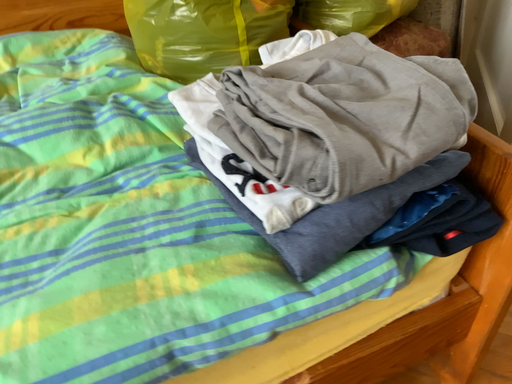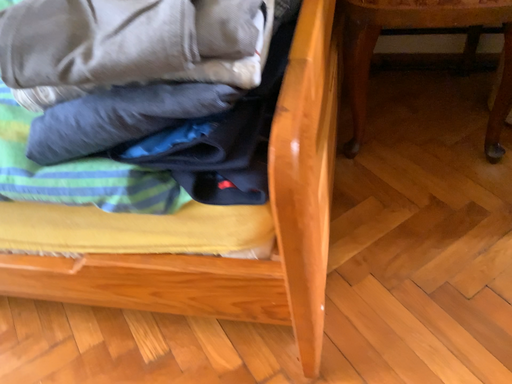
Question: Which way did the camera rotate in the video?

Choices:
 (A) rotated left
 (B) rotated right

Answer: (A)